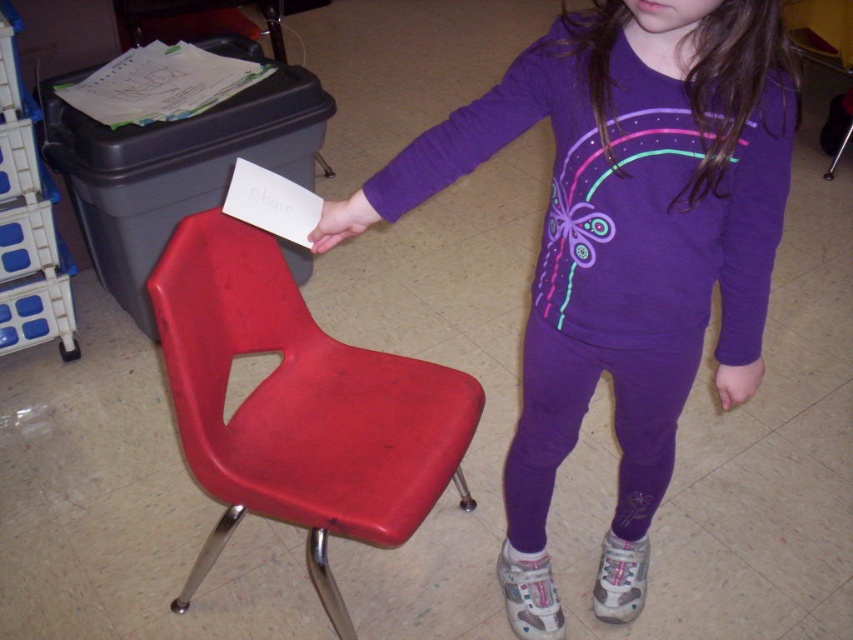
The girl is holding a small white card. She has a purple fleece sweatshirt at upper center and a matte plastic hand at center. Which object is wider?

The purple fleece sweatshirt at upper center is wider than the matte plastic hand at center.

You are standing at the point with coordinates point (357,212). You want to walk to the point with coordinates point (553,285). Which direction should you move in relative to the girl?

You should move behind the girl to reach point (553,285) from point (357,212) because point (553,285) is behind point (357,212).

You are standing at the position of the girl holding the card. Which of the two points, point (x=608, y=244) or point (x=734, y=396), is closer to you?

Point (x=608, y=244) is closer to you because it is in front of point (x=734, y=396).